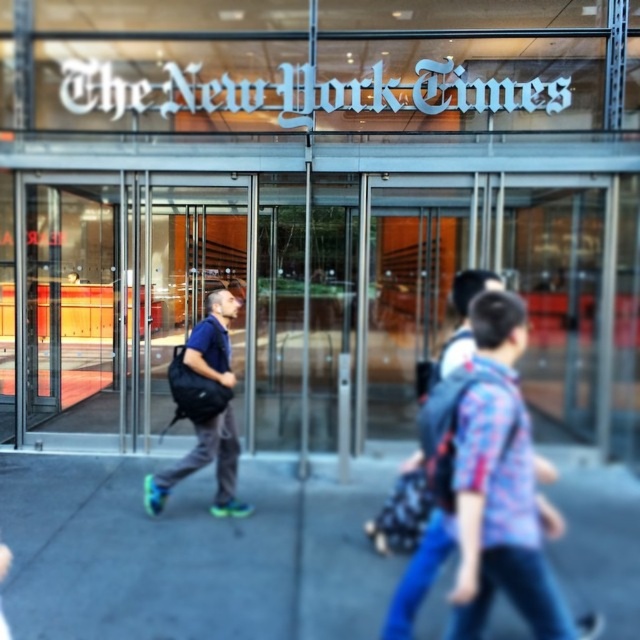
Question: Can you confirm if gray concrete sidewalk at center is positioned below transparent glass door at center?

Choices:
 (A) no
 (B) yes

Answer: (B)

Question: Which object is positioned farthest from the flannel shirt at center?

Choices:
 (A) gray concrete sidewalk at center
 (B) transparent glass door at center

Answer: (B)

Question: Does gray concrete sidewalk at center have a lesser width compared to flannel shirt at center?

Choices:
 (A) no
 (B) yes

Answer: (A)

Question: Which of the following is the closest to the observer?

Choices:
 (A) gray concrete sidewalk at center
 (B) matte black backpack at center

Answer: (A)

Question: Can you confirm if black backpack at center is positioned below matte black backpack at center?

Choices:
 (A) yes
 (B) no

Answer: (B)

Question: Which point is closer to the camera taking this photo?

Choices:
 (A) (225, 524)
 (B) (154, 292)
 (C) (70, 228)
 (D) (518, 582)

Answer: (D)